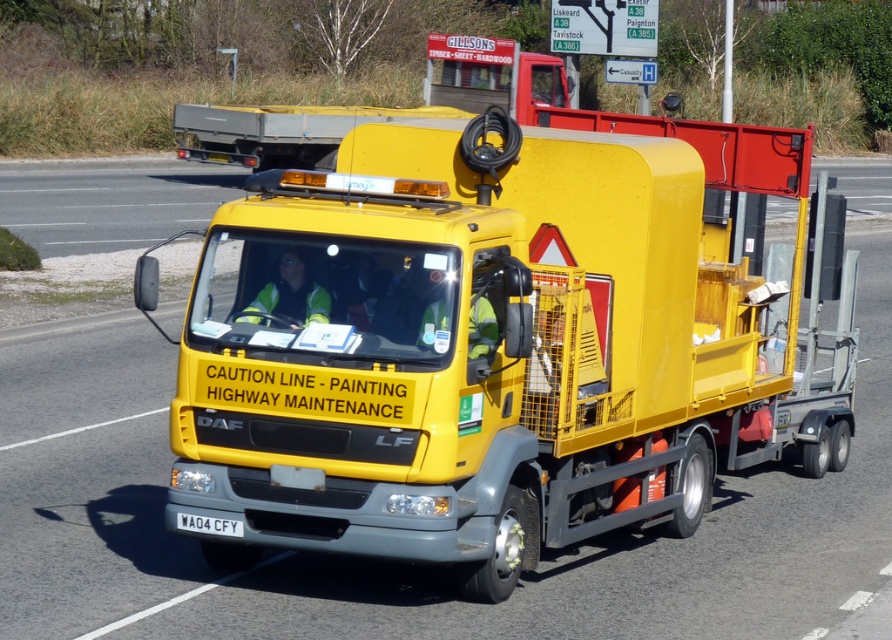
You are a traffic officer observing a vehicle on the highway. You notice the white plastic license plate at center and the yellow matte truck at center. Based on their positions, can you determine which object is closer to the left side of the road?

The white plastic license plate at center is closer to the left side of the road because the yellow matte truck at center is positioned to its right.

Based on the scene description, what is the 2D coordinate of the yellow matte truck at center?

The 2D coordinate of the yellow matte truck at center is at point (486, 349).

You are a pedestrian standing on the sidewalk and see the yellow matte truck at center and the white plastic license plate at center. Which object is closer to you?

The yellow matte truck at center is closer to you than the white plastic license plate at center.